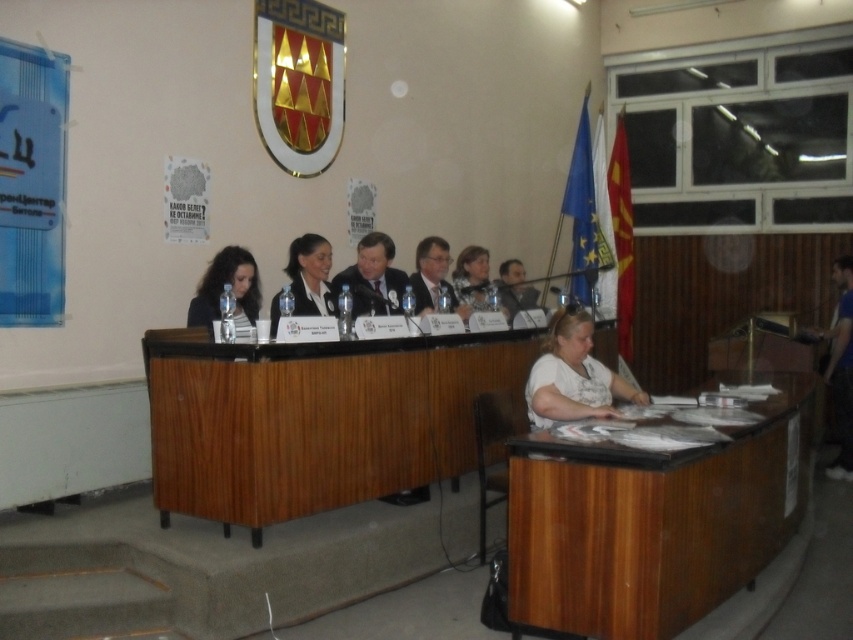
Can you confirm if wooden table at lower right is thinner than matte black shirt at center?

Incorrect, wooden table at lower right's width is not less than matte black shirt at center's.

The image size is (853, 640). I want to click on wooden table at lower right, so click(x=654, y=520).

Is point (479, 257) behind point (524, 305)?

No, it is in front of (524, 305).

Is point (468, 289) closer to camera compared to point (524, 282)?

Yes.

Between point (477, 300) and point (515, 262), which one is positioned behind?

The point (515, 262) is behind.

Where is `matte black jacket at upper center`? This screenshot has height=640, width=853. matte black jacket at upper center is located at coordinates (474, 280).

Is matte black hair at left to the left of matte black shirt at center from the viewer's perspective?

Yes, matte black hair at left is to the left of matte black shirt at center.

Is matte black hair at left thinner than matte black shirt at center?

Yes.

Locate an element on the screen. This screenshot has height=640, width=853. matte black hair at left is located at coordinates (x=222, y=288).

The image size is (853, 640). In order to click on matte black hair at left in this screenshot , I will do `click(222, 288)`.